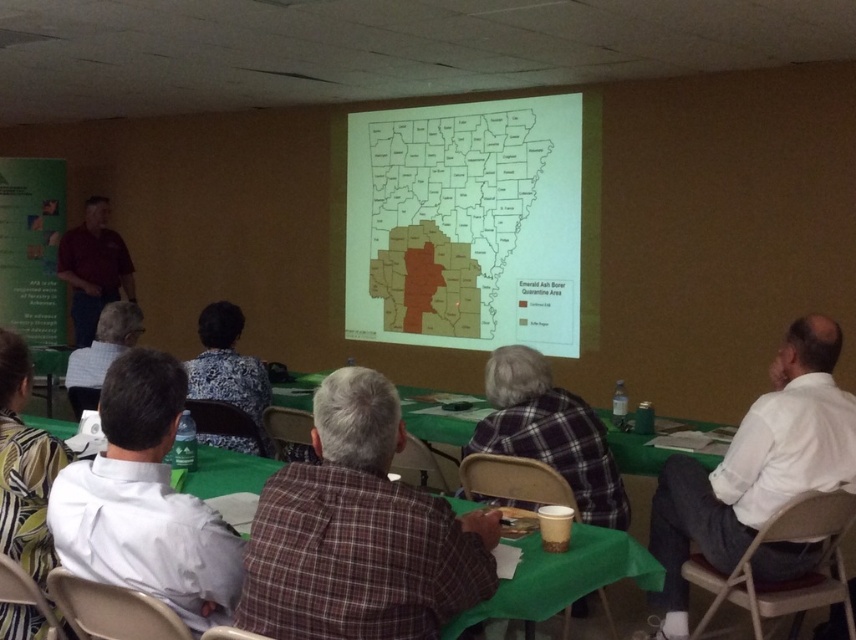
Looking at this image, can you confirm if white shirt at lower right is positioned to the right of maroon shirt at left?

Indeed, white shirt at lower right is positioned on the right side of maroon shirt at left.

Is point (710, 547) positioned in front of point (97, 310)?

That is True.

Which is in front, point (705, 556) or point (100, 259)?

Point (705, 556) is in front.

At what (x,y) coordinates should I click in order to perform the action: click on white shirt at lower right. Please return your answer as a coordinate pair (x, y). Image resolution: width=856 pixels, height=640 pixels. Looking at the image, I should click on (755, 467).

Is matte paper map at upper center to the right of maroon shirt at left from the viewer's perspective?

Correct, you'll find matte paper map at upper center to the right of maroon shirt at left.

Who is more distant from viewer, (512, 292) or (60, 237)?

Positioned behind is point (60, 237).

Measure the distance between matte paper map at upper center and camera.

A distance of 5.64 meters exists between matte paper map at upper center and camera.

Identify the location of matte paper map at upper center. This screenshot has width=856, height=640. (473, 225).

Is plaid shirt at center positioned before white shirt at lower right?

Yes, it is.

Can you confirm if plaid shirt at center is positioned below white shirt at lower right?

Actually, plaid shirt at center is above white shirt at lower right.

Where is `plaid shirt at center`? plaid shirt at center is located at coordinates (360, 532).